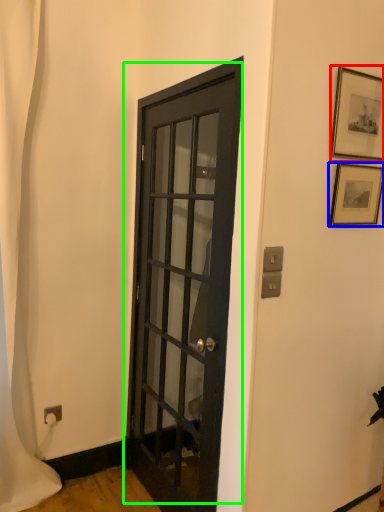
Question: Which object is the closest to the picture frame (highlighted by a red box)? Choose among these: picture frame (highlighted by a blue box) or door (highlighted by a green box).

Choices:
 (A) picture frame
 (B) door

Answer: (A)